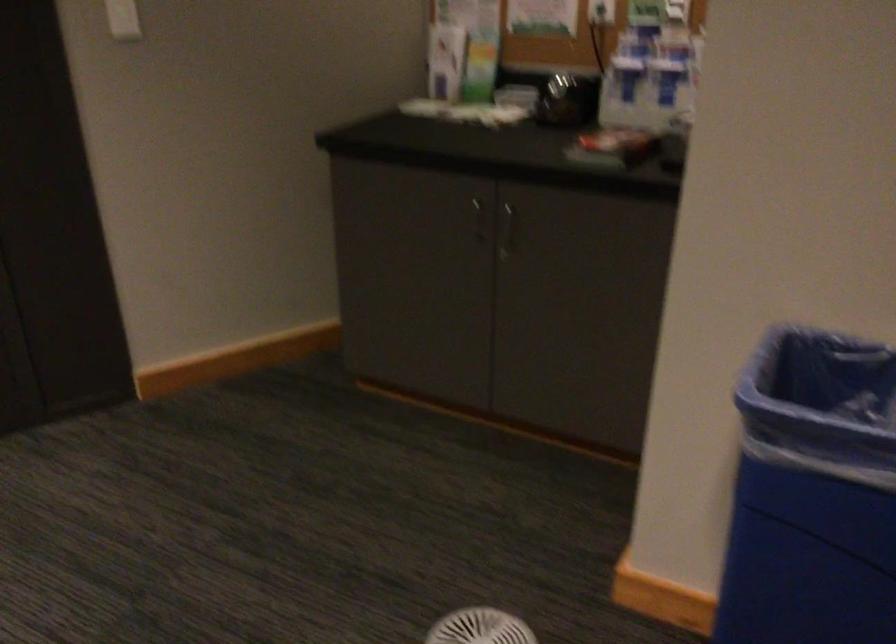
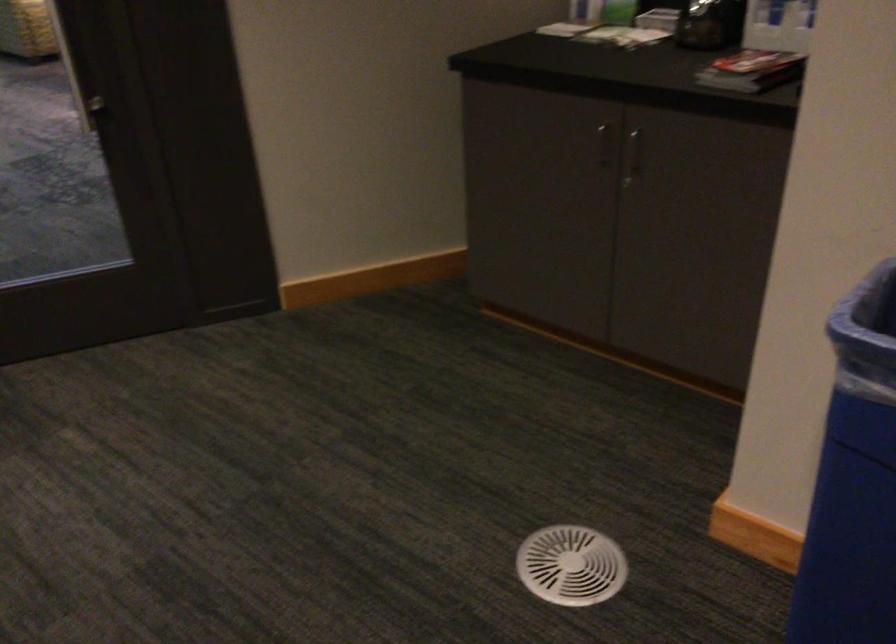
Locate, in the second image, the point that corresponds to pixel 618 147 in the first image.

(751, 71)